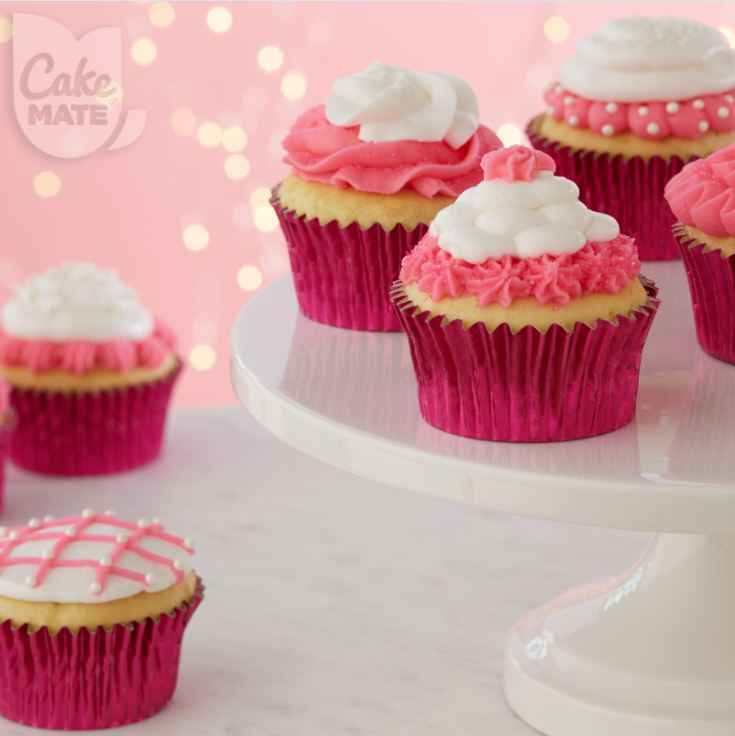
At what (x,y) coordinates should I click in order to perform the action: click on cakestand. Please return your answer as a coordinate pair (x, y). The height and width of the screenshot is (736, 735). Looking at the image, I should click on (623, 470).